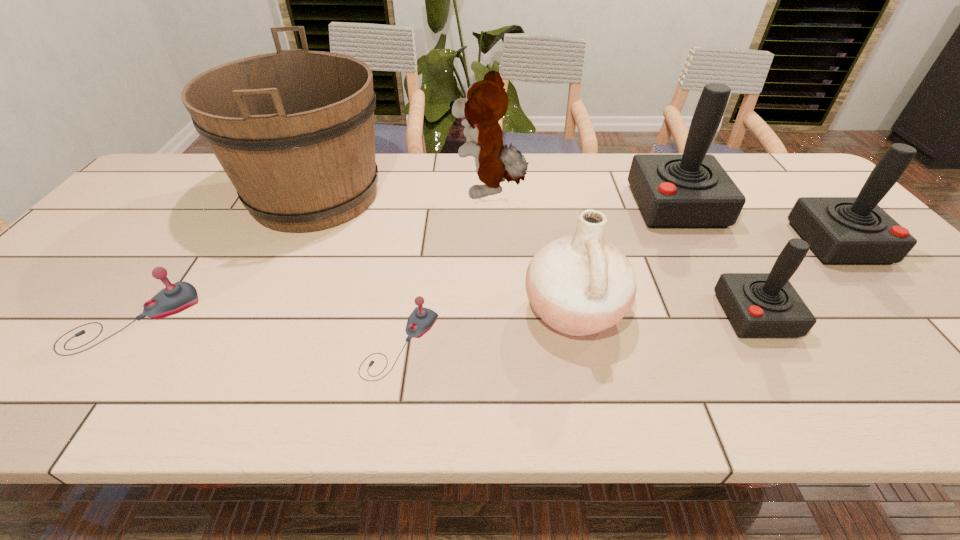
At what (x,y) coordinates should I click in order to perform the action: click on puppy situated at the far edge. Please return your answer as a coordinate pair (x, y). Looking at the image, I should click on (486, 102).

At what (x,y) coordinates should I click in order to perform the action: click on object at the near edge. Please return your answer as a coordinate pair (x, y). Looking at the image, I should click on (421, 320).

Identify the location of object present at the left edge. The height and width of the screenshot is (540, 960). (175, 298).

Find the location of `object located at the right edge`. object located at the right edge is located at coordinates (840, 230).

In the image, there is a desktop. Where is `free space at the far edge`? The width and height of the screenshot is (960, 540). free space at the far edge is located at coordinates (567, 193).

This screenshot has width=960, height=540. Identify the location of blank area at the near edge. (742, 393).

In the image, there is a desktop. Where is `vacant space at the left edge`? The height and width of the screenshot is (540, 960). vacant space at the left edge is located at coordinates tap(34, 321).

You are a GUI agent. You are given a task and a screenshot of the screen. Output one action in this format:
    pyautogui.click(x=<x>, y=<y>)
    Task: Click on the free space at the right edge
    Image resolution: width=960 pixels, height=540 pixels.
    Given the screenshot: What is the action you would take?
    pyautogui.click(x=959, y=371)

Image resolution: width=960 pixels, height=540 pixels. In the image, there is a desktop. Find the location of `free space at the far left corner`. free space at the far left corner is located at coordinates (208, 168).

Find the location of a particular element. Image resolution: width=960 pixels, height=540 pixels. vacant space at the near right corner of the desktop is located at coordinates (953, 401).